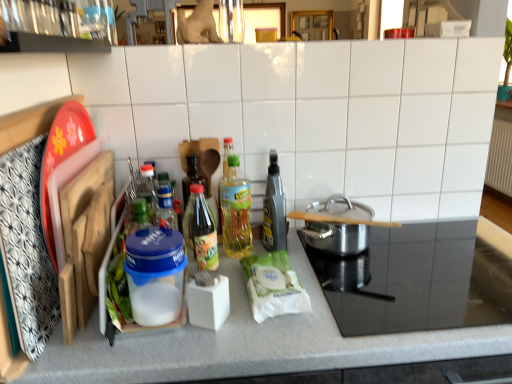
The height and width of the screenshot is (384, 512). I want to click on free space in front of white matte paper towel at center, so click(x=272, y=340).